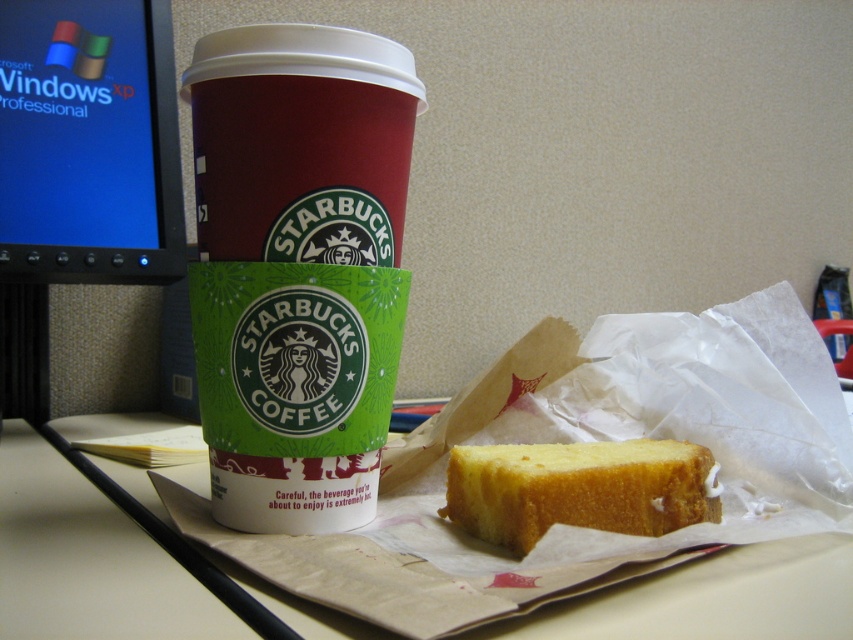
You are organizing a desk and need to place the matte paper cup at left and the matte black monitor at left. Since the desk has limited space, which object should you place first to ensure both fit properly?

The matte paper cup at left should be placed first because it is smaller than the matte black monitor at left, allowing more space for the larger monitor afterward.

You are standing at the origin point of the desk coordinate system. There is a matte paper cup at left represented by point (299, 266). Can you tell me the coordinates of the matte paper cup at left?

The coordinates of the matte paper cup at left are point (299, 266).

You are organizing a desk and need to place the matte paper cup at left and the matte black monitor at left side by side. Given their thickness, which object should you place closer to the edge of the desk to save space?

The matte paper cup at left is thinner than the matte black monitor at left, so placing the matte paper cup at left closer to the edge of the desk would save more space since it takes up less width.